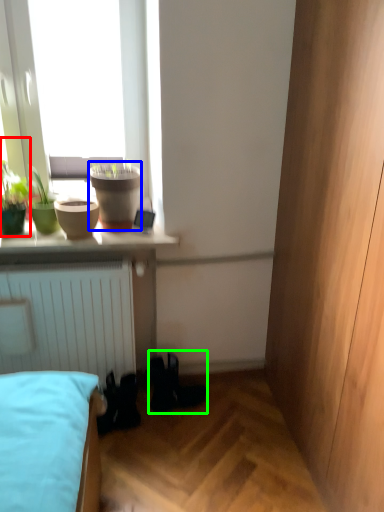
Question: Estimate the real-world distances between objects in this image. Which object is closer to houseplant (highlighted by a red box), flowerpot (highlighted by a blue box) or shoe (highlighted by a green box)?

Choices:
 (A) flowerpot
 (B) shoe

Answer: (A)